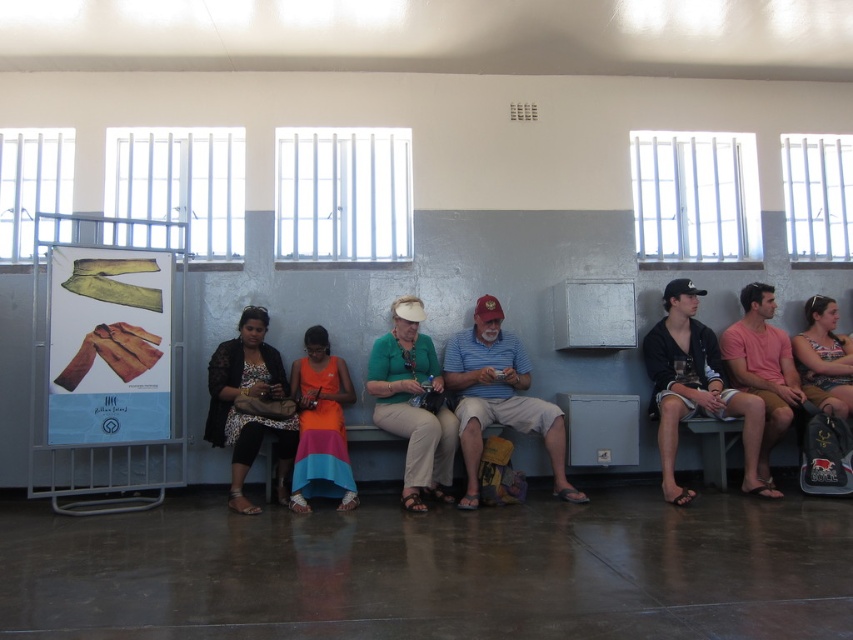
Which is more to the right, black cotton shorts at right or green matte shirt at center?

Positioned to the right is black cotton shorts at right.

Who is positioned more to the left, black cotton shorts at right or green matte shirt at center?

green matte shirt at center

Is point (669, 314) farther from viewer compared to point (405, 320)?

That is True.

In order to click on black cotton shorts at right in this screenshot , I will do `click(695, 388)`.

Between striped cotton shirt at center and green matte shirt at center, which one appears on the left side from the viewer's perspective?

green matte shirt at center is more to the left.

Who is positioned more to the right, striped cotton shirt at center or green matte shirt at center?

striped cotton shirt at center

Measure the distance between striped cotton shirt at center and camera.

4.70 meters

Find the location of `striped cotton shirt at center`. striped cotton shirt at center is located at coordinates (498, 396).

Between green matte shirt at center and orange fabric dress at center, which one appears on the right side from the viewer's perspective?

green matte shirt at center

What do you see at coordinates (412, 404) in the screenshot? This screenshot has height=640, width=853. I see `green matte shirt at center` at bounding box center [412, 404].

What are the coordinates of `green matte shirt at center` in the screenshot? It's located at (412, 404).

I want to click on green matte shirt at center, so click(x=412, y=404).